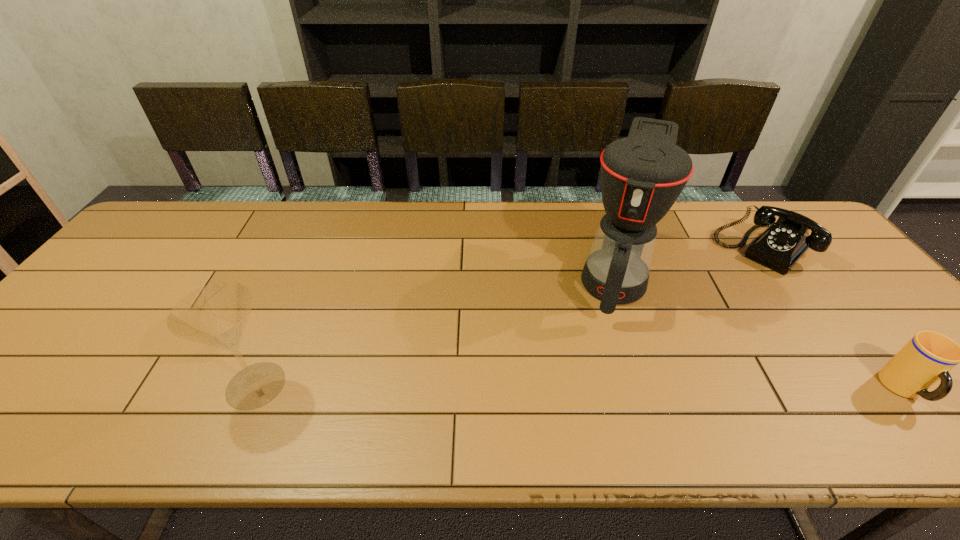
Where is `vacant space situated 0.150m on the dial of the telephone`? This screenshot has height=540, width=960. vacant space situated 0.150m on the dial of the telephone is located at coordinates (717, 292).

You are a GUI agent. You are given a task and a screenshot of the screen. Output one action in this format:
    pyautogui.click(x=<x>, y=<y>)
    Task: Click on the vacant space located on the dial of the telephone
    
    Given the screenshot: What is the action you would take?
    pyautogui.click(x=709, y=299)

At what (x,y) coordinates should I click in order to perform the action: click on free location located on the dial of the telephone. Please return your answer as a coordinate pair (x, y). This screenshot has height=540, width=960. Looking at the image, I should click on (668, 341).

The height and width of the screenshot is (540, 960). Identify the location of coffee maker at the far edge. (642, 175).

The image size is (960, 540). Identify the location of telephone that is positioned at the far edge. (784, 242).

Identify the location of flute glass that is at the near edge. This screenshot has width=960, height=540. (215, 315).

Locate an element on the screen. This screenshot has height=540, width=960. cup situated at the near edge is located at coordinates (928, 357).

Find the location of `cup present at the right edge`. cup present at the right edge is located at coordinates (928, 357).

This screenshot has width=960, height=540. In order to click on telephone present at the right edge in this screenshot , I will do `click(784, 242)`.

Find the location of a particular element. This screenshot has height=540, width=960. object positioned at the far right corner is located at coordinates (784, 242).